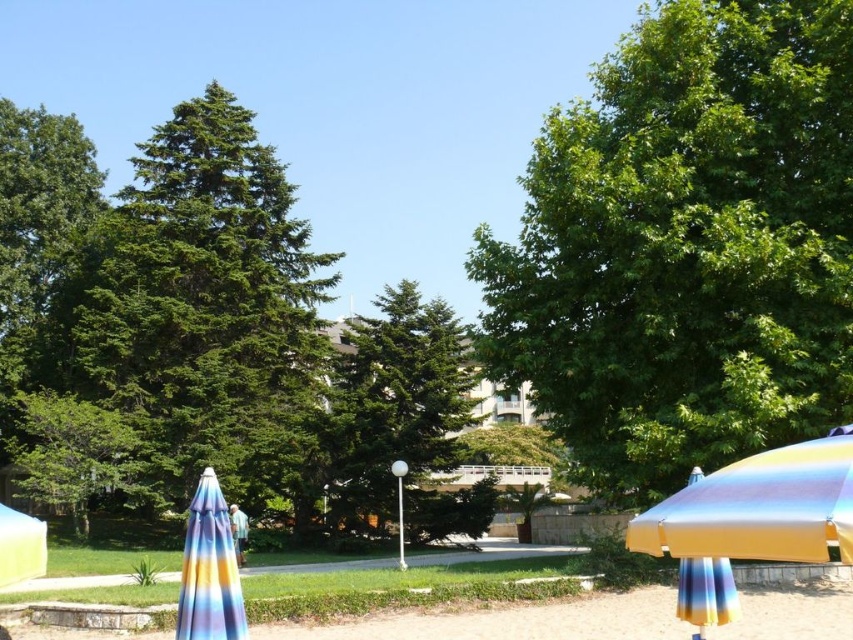
Which is in front, point (419, 468) or point (741, 541)?

Point (741, 541)

Which is more to the left, green matte tree at center or metallic rainbow umbrella at lower right?

From the viewer's perspective, green matte tree at center appears more on the left side.

Locate an element on the screen. The image size is (853, 640). green matte tree at center is located at coordinates (399, 420).

Locate an element on the screen. green matte tree at center is located at coordinates (399, 420).

Is green matte tree at center bigger than rainbow striped fabric umbrella at lower right?

Yes.

What do you see at coordinates (399, 420) in the screenshot? I see `green matte tree at center` at bounding box center [399, 420].

The height and width of the screenshot is (640, 853). What do you see at coordinates (399, 420) in the screenshot?
I see `green matte tree at center` at bounding box center [399, 420].

Where is `green matte tree at center`? green matte tree at center is located at coordinates (399, 420).

Is green leafy tree at upper right taller than multicolored fabric umbrella at lower left?

Indeed, green leafy tree at upper right has a greater height compared to multicolored fabric umbrella at lower left.

Is green leafy tree at upper right to the right of multicolored fabric umbrella at lower left from the viewer's perspective?

Yes, green leafy tree at upper right is to the right of multicolored fabric umbrella at lower left.

Which is behind, point (834, 154) or point (181, 579)?

Positioned behind is point (834, 154).

At what (x,y) coordinates should I click in order to perform the action: click on green leafy tree at upper right. Please return your answer as a coordinate pair (x, y). This screenshot has height=640, width=853. Looking at the image, I should click on pos(686,246).